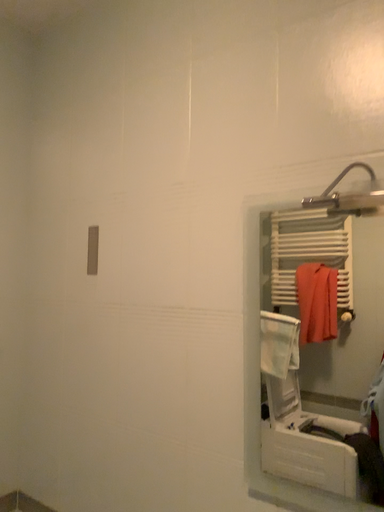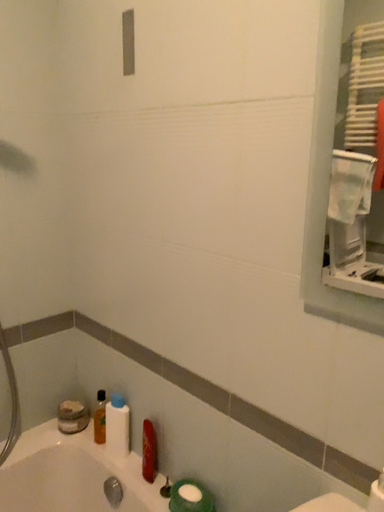
Question: How did the camera likely rotate when shooting the video?

Choices:
 (A) rotated downward
 (B) rotated upward

Answer: (A)